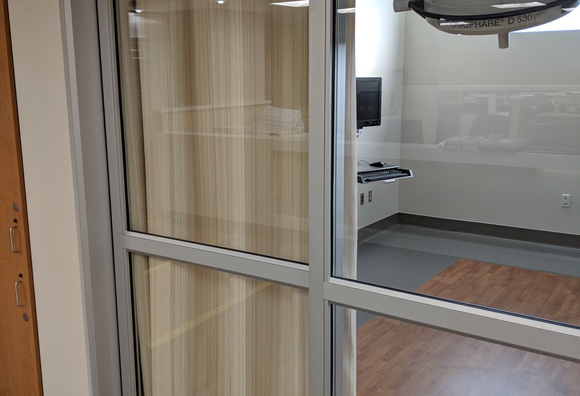
The width and height of the screenshot is (580, 396). I want to click on metal outlet, so click(360, 201), click(369, 196).